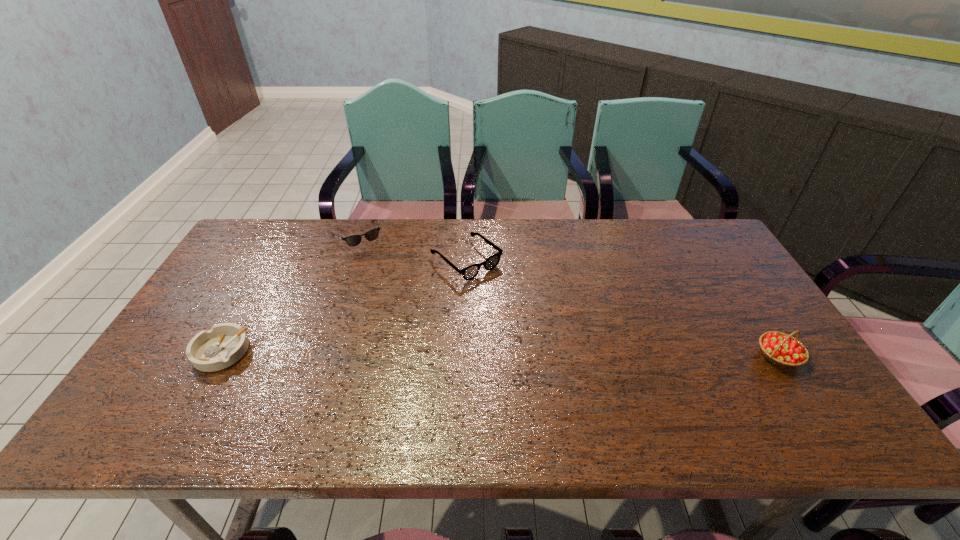
Identify the location of ashtray. (223, 345).

Identify the location of the leftmost object. This screenshot has width=960, height=540. (223, 345).

Where is `the tallest object`? This screenshot has height=540, width=960. the tallest object is located at coordinates (782, 349).

Find the location of a particular element. strawberry is located at coordinates (782, 349).

The width and height of the screenshot is (960, 540). In order to click on the second object from right to left in this screenshot , I will do `click(470, 272)`.

In order to click on the third object from right to left in this screenshot , I will do `click(354, 240)`.

What are the coordinates of `free space located 0.060m on the back of the leftmost object` in the screenshot? It's located at (242, 315).

Find the location of a particular element. free space located on the back of the strawberry is located at coordinates (752, 315).

Where is `vacant space located on the arms of the spectacles`? vacant space located on the arms of the spectacles is located at coordinates (523, 310).

Identify the location of free spot located on the arms of the spectacles. This screenshot has width=960, height=540. (545, 329).